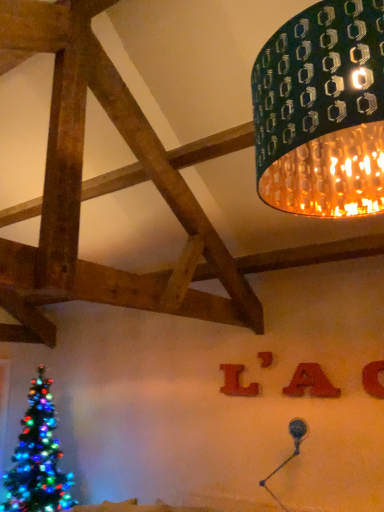
Question: Considering the relative sizes of red felt letter a at upper center, the 2th alphabet from the back, and matte red letter at upper center in the image provided, is red felt letter a at upper center, the 2th alphabet from the back, bigger than matte red letter at upper center?

Choices:
 (A) yes
 (B) no

Answer: (A)

Question: Can you confirm if red felt letter a at upper center, the 2th alphabet from the back, is shorter than matte red letter at upper center?

Choices:
 (A) no
 (B) yes

Answer: (A)

Question: Can we say red felt letter a at upper center, the second alphabet viewed from the left, lies outside matte red letter at upper center?

Choices:
 (A) yes
 (B) no

Answer: (A)

Question: From the image's perspective, would you say red felt letter a at upper center, the second alphabet from the right, is positioned over matte red letter at upper center?

Choices:
 (A) no
 (B) yes

Answer: (A)

Question: Is red felt letter a at upper center, the 2th alphabet from the back, at the right side of matte red letter at upper center?

Choices:
 (A) no
 (B) yes

Answer: (B)

Question: Considering the positions of point (372, 367) and point (256, 353), is point (372, 367) closer or farther from the camera than point (256, 353)?

Choices:
 (A) farther
 (B) closer

Answer: (B)

Question: In terms of size, does orange matte letter at upper right, arranged as the 3th alphabet when viewed from the back, appear bigger or smaller than matte red letter at upper center?

Choices:
 (A) big
 (B) small

Answer: (A)

Question: In the image, is orange matte letter at upper right, placed as the first alphabet when sorted from front to back, positioned in front of or behind matte red letter at upper center?

Choices:
 (A) behind
 (B) front

Answer: (B)

Question: Is orange matte letter at upper right, placed as the first alphabet when sorted from front to back, inside or outside of matte red letter at upper center?

Choices:
 (A) outside
 (B) inside

Answer: (A)

Question: From the image's perspective, relative to matte red letter at center, positioned as the 3th alphabet in right-to-left order, is red felt letter a at upper center, the second alphabet from the right, above or below?

Choices:
 (A) above
 (B) below

Answer: (A)

Question: Is red felt letter a at upper center, the second alphabet viewed from the left, bigger or smaller than matte red letter at center, acting as the first alphabet starting from the back?

Choices:
 (A) big
 (B) small

Answer: (A)

Question: Is red felt letter a at upper center, the 2th alphabet in the front-to-back sequence, taller or shorter than matte red letter at center, which appears as the 3th alphabet when viewed from the front?

Choices:
 (A) short
 (B) tall

Answer: (A)

Question: Is point (334, 396) closer or farther from the camera than point (223, 380)?

Choices:
 (A) farther
 (B) closer

Answer: (B)

Question: Relative to metallic silver table lamp at lower right, is orange matte letter at upper right, which is the 1th alphabet from right to left, in front or behind?

Choices:
 (A) front
 (B) behind

Answer: (B)

Question: From the image's perspective, is orange matte letter at upper right, the third alphabet from the left, positioned above or below metallic silver table lamp at lower right?

Choices:
 (A) below
 (B) above

Answer: (B)